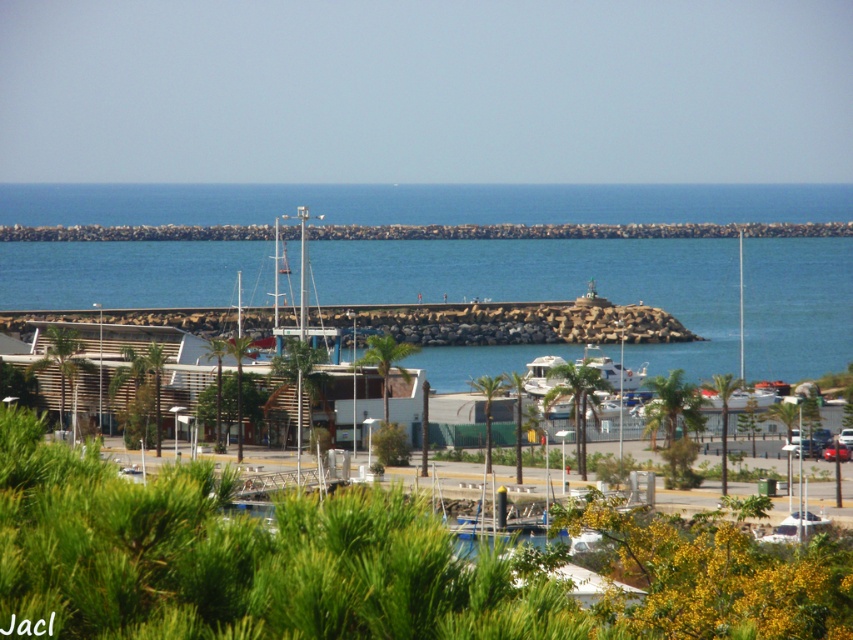
Question: Among these objects, which one is farthest from the camera?

Choices:
 (A) rocky jetty at center
 (B) blue stone water at center
 (C) shiny red car at center

Answer: (A)

Question: Can you confirm if blue stone water at center is positioned below shiny red car at center?

Choices:
 (A) yes
 (B) no

Answer: (B)

Question: Which of the following is the closest to the observer?

Choices:
 (A) rocky jetty at center
 (B) blue stone water at center

Answer: (B)

Question: Is blue stone water at center wider than rocky jetty at center?

Choices:
 (A) yes
 (B) no

Answer: (B)

Question: Can you confirm if rocky jetty at center is bigger than shiny red car at center?

Choices:
 (A) yes
 (B) no

Answer: (A)

Question: Which of the following is the closest to the observer?

Choices:
 (A) rocky jetty at center
 (B) shiny red car at center

Answer: (B)